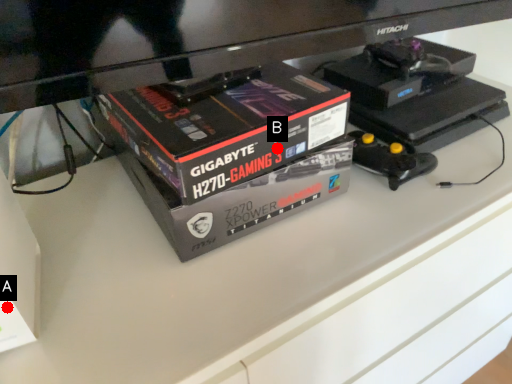
Question: Two points are circled on the image, labeled by A and B beside each circle. Which point is closer to the camera taking this photo?

Choices:
 (A) A is closer
 (B) B is closer

Answer: (A)